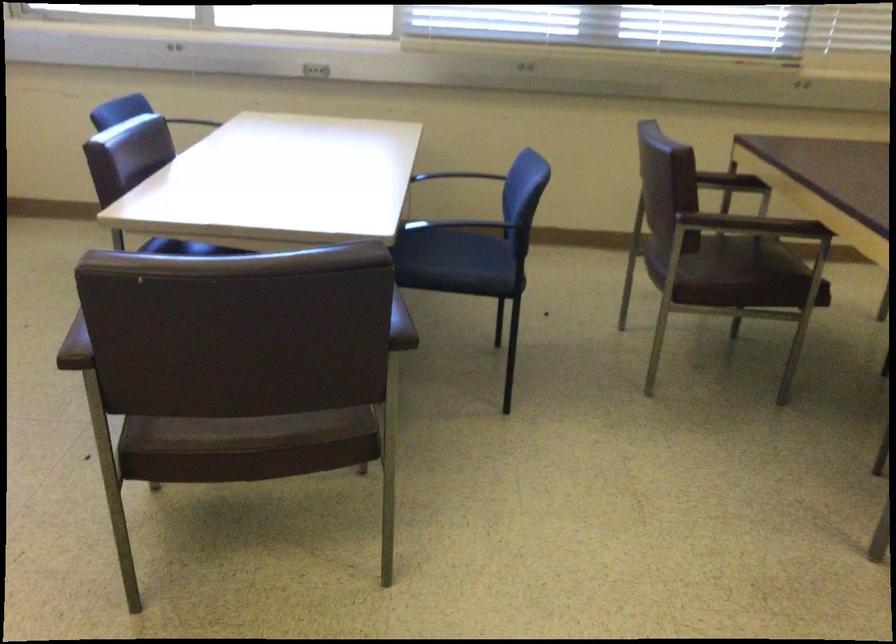
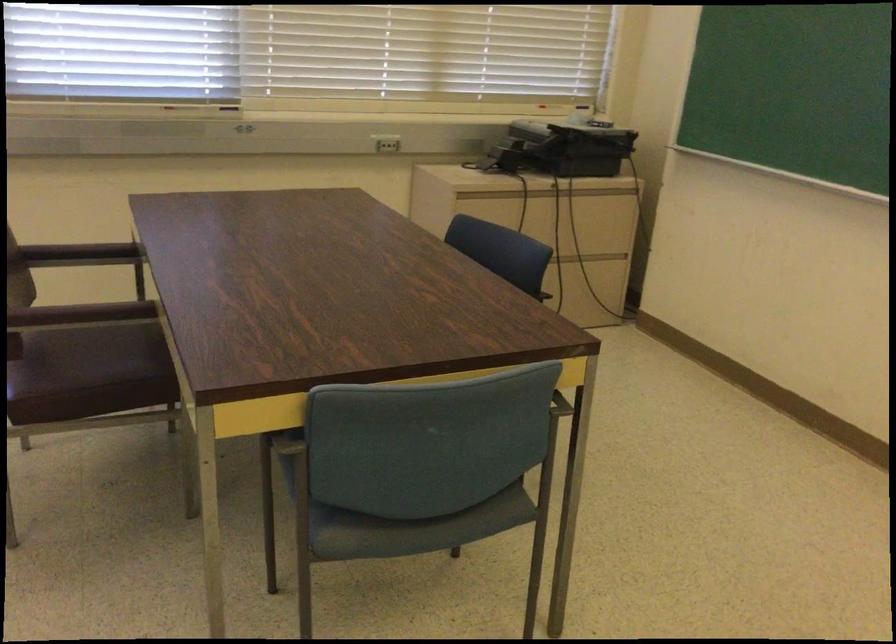
Question: The camera is either moving clockwise (left) or counter-clockwise (right) around the object. The first image is from the beginning of the video and the second image is from the end. Is the camera moving left or right when shooting the video?

Choices:
 (A) Left
 (B) Right

Answer: (A)